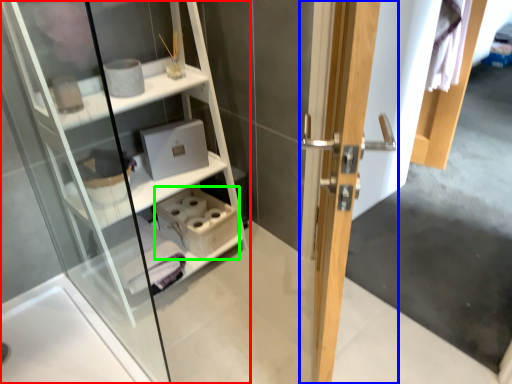
Question: Estimate the real-world distances between objects in this image. Which object is farther from shelf (highlighted by a red box), door (highlighted by a blue box) or cabinet (highlighted by a green box)?

Choices:
 (A) door
 (B) cabinet

Answer: (A)